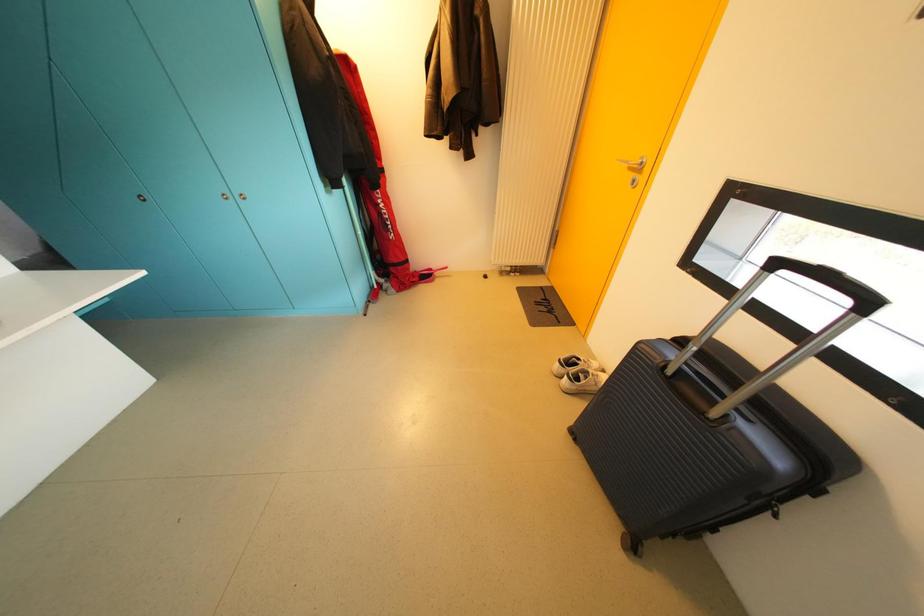
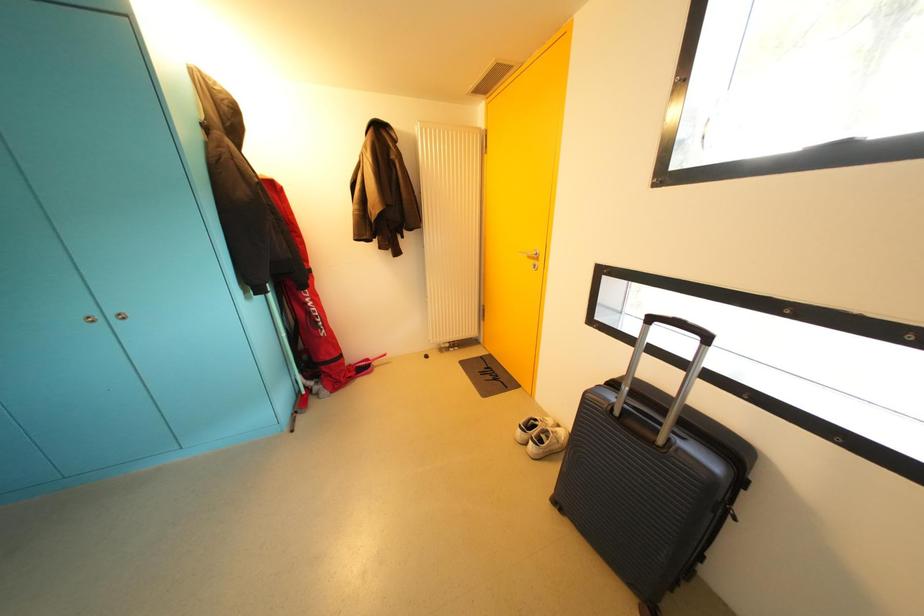
The first image is from the beginning of the video and the second image is from the end. How did the camera likely rotate when shooting the video?

The rotation direction of the camera is right-up.